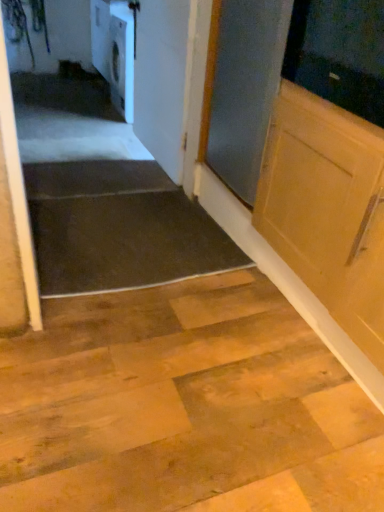
Question: Is white glossy dishwasher at upper left surrounding dark rubber mat at lower left?

Choices:
 (A) no
 (B) yes

Answer: (A)

Question: Is white glossy dishwasher at upper left far from dark rubber mat at lower left?

Choices:
 (A) no
 (B) yes

Answer: (B)

Question: Is white glossy dishwasher at upper left thinner than dark rubber mat at lower left?

Choices:
 (A) yes
 (B) no

Answer: (A)

Question: Is white glossy dishwasher at upper left to the left of dark rubber mat at lower left from the viewer's perspective?

Choices:
 (A) yes
 (B) no

Answer: (A)

Question: Could you tell me if white glossy dishwasher at upper left is turned towards dark rubber mat at lower left?

Choices:
 (A) no
 (B) yes

Answer: (A)

Question: Does white glossy dishwasher at upper left have a lesser height compared to dark rubber mat at lower left?

Choices:
 (A) no
 (B) yes

Answer: (A)

Question: Is white glossy dishwasher at upper left to the right of white glossy door at upper center from the viewer's perspective?

Choices:
 (A) no
 (B) yes

Answer: (A)

Question: Does white glossy dishwasher at upper left come behind white glossy door at upper center?

Choices:
 (A) yes
 (B) no

Answer: (A)

Question: From the image's perspective, is white glossy dishwasher at upper left located above white glossy door at upper center?

Choices:
 (A) yes
 (B) no

Answer: (A)

Question: Is white glossy dishwasher at upper left outside white glossy door at upper center?

Choices:
 (A) yes
 (B) no

Answer: (A)

Question: Does white glossy dishwasher at upper left touch white glossy door at upper center?

Choices:
 (A) no
 (B) yes

Answer: (A)

Question: Is white glossy door at upper center completely or partially inside white glossy dishwasher at upper left?

Choices:
 (A) yes
 (B) no

Answer: (B)

Question: Does dark rubber mat at lower left come in front of white glossy door at upper center?

Choices:
 (A) no
 (B) yes

Answer: (B)